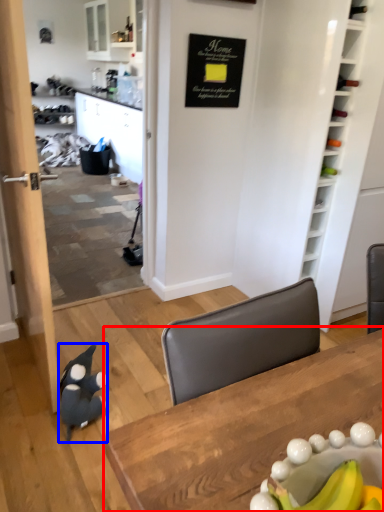
Question: Which of the following is the closest to the observer, table (highlighted by a red box) or penguin (highlighted by a blue box)?

Choices:
 (A) table
 (B) penguin

Answer: (A)